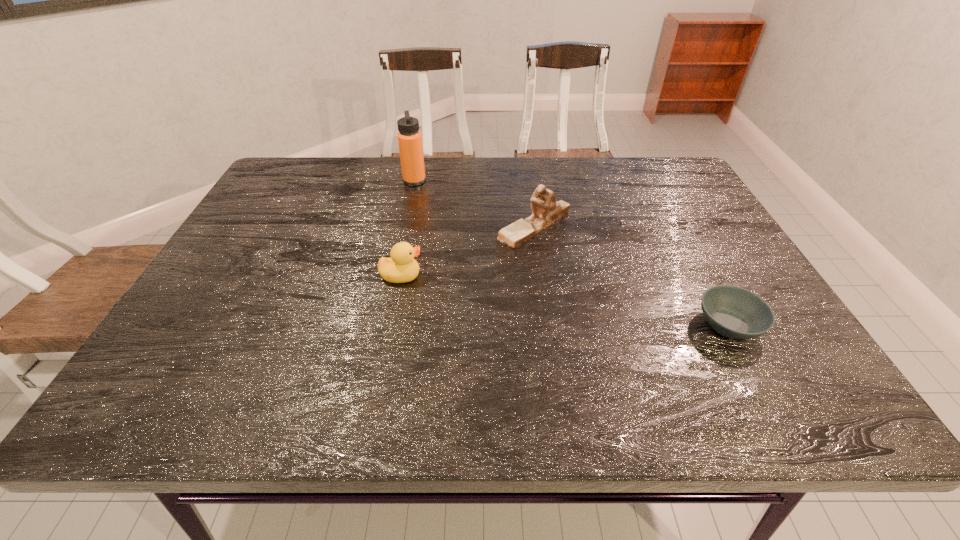
Where is `free space located on the front-facing side of the second farthest object`? This screenshot has height=540, width=960. free space located on the front-facing side of the second farthest object is located at coordinates (396, 226).

Image resolution: width=960 pixels, height=540 pixels. What are the coordinates of `vacant area situated 0.290m on the front-facing side of the second farthest object` in the screenshot? It's located at (388, 226).

Locate an element on the screen. The width and height of the screenshot is (960, 540). vacant area situated 0.220m at the beak of the duck is located at coordinates (516, 276).

Where is `vacant area situated on the front of the rightmost object`? The height and width of the screenshot is (540, 960). vacant area situated on the front of the rightmost object is located at coordinates (777, 415).

Where is `object present at the far edge`? The width and height of the screenshot is (960, 540). object present at the far edge is located at coordinates (409, 137).

This screenshot has width=960, height=540. What are the coordinates of `object that is at the right edge` in the screenshot? It's located at (734, 312).

You are a GUI agent. You are given a task and a screenshot of the screen. Output one action in this format:
    pyautogui.click(x=<x>, y=<y>)
    Task: Click on the vacant area at the far edge of the desktop
    This screenshot has height=540, width=960.
    Given the screenshot: What is the action you would take?
    pyautogui.click(x=428, y=192)

At what (x,y) coordinates should I click in order to perform the action: click on vacant space at the near edge of the desktop. Please return your answer as a coordinate pair (x, y). This screenshot has width=960, height=540. Looking at the image, I should click on (353, 397).

You are a GUI agent. You are given a task and a screenshot of the screen. Output one action in this format:
    pyautogui.click(x=<x>, y=<y>)
    Task: Click on the free spot at the left edge of the desktop
    The height and width of the screenshot is (540, 960).
    Given the screenshot: What is the action you would take?
    pyautogui.click(x=266, y=220)

This screenshot has height=540, width=960. In the image, there is a desktop. In order to click on vacant space at the right edge in this screenshot , I will do `click(682, 218)`.